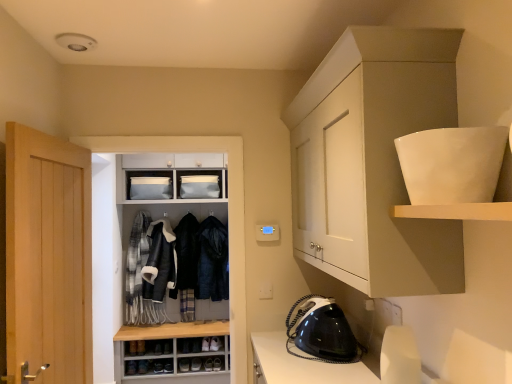
In order to face white matte cabinet at upper right, acting as the second cabinetry starting from the back, should I rotate leftwards or rightwards?

You should look right and rotate roughly 11.942 degrees.

Where is `leather shoes at center`? This screenshot has width=512, height=384. leather shoes at center is located at coordinates (196, 364).

What is the approximate height of leather shoes at center?

It is 6.07 centimeters.

This screenshot has width=512, height=384. I want to click on velvet black coat at center, the second clothing from the right, so click(x=187, y=251).

I want to click on white matte shelf at upper right, positioned as the second shelf in top-to-bottom order, so click(x=456, y=211).

What do you see at coordinates (213, 261) in the screenshot? I see `dark blue fur-lined coat at center, which ranks as the fourth clothing in left-to-right order` at bounding box center [213, 261].

Where is `dark blue fur-lined coat at center, which is the 1th clothing in right-to-left order`? The width and height of the screenshot is (512, 384). dark blue fur-lined coat at center, which is the 1th clothing in right-to-left order is located at coordinates (213, 261).

I want to click on light wood door at left, so [x=48, y=256].

Where is `footwear below the black glossy iron at lower right (from the image's perspective)`? footwear below the black glossy iron at lower right (from the image's perspective) is located at coordinates (196, 364).

Between black glossy iron at lower right and leather shoes at center, which one has less height?

leather shoes at center.

Considering the relative positions of black glossy iron at lower right and leather shoes at center in the image provided, is black glossy iron at lower right behind leather shoes at center?

No, black glossy iron at lower right is closer to the camera.

Is point (330, 312) positioned behind point (197, 368)?

No, (330, 312) is in front of (197, 368).

Is black glossy iron at lower right not within velvet black coat at center, acting as the 3th clothing starting from the left?

black glossy iron at lower right lies outside velvet black coat at center, acting as the 3th clothing starting from the left,'s area.

Is black glossy iron at lower right facing towards velvet black coat at center, acting as the 3th clothing starting from the left?

No, black glossy iron at lower right does not turn towards velvet black coat at center, acting as the 3th clothing starting from the left.

From a real-world perspective, is black glossy iron at lower right on top of velvet black coat at center, the second clothing from the right?

No, from a real-world perspective, black glossy iron at lower right is not on top of velvet black coat at center, the second clothing from the right.

Relative to velvet black coat at center, the second clothing from the right, is black glossy iron at lower right in front or behind?

black glossy iron at lower right is in front of velvet black coat at center, the second clothing from the right.

Is leather shoes at center further to camera compared to light wood door at left?

Yes, leather shoes at center is further from the camera.

Is leather shoes at center wider than light wood door at left?

Yes, leather shoes at center is wider than light wood door at left.

Is light wood door at left at the back of leather shoes at center?

leather shoes at center is not turned away from light wood door at left.

Looking at this image, how different are the orientations of leather shoes at center and light wood door at left in degrees?

80.8 degrees separate the facing orientations of leather shoes at center and light wood door at left.

Is white matte cabinet at upper right, acting as the first cabinetry starting from the right, beside plaid wool scarf at center left, which is the fourth clothing in right-to-left order?

No, white matte cabinet at upper right, acting as the first cabinetry starting from the right, is not with plaid wool scarf at center left, which is the fourth clothing in right-to-left order.

Consider the image. How much distance is there between white matte cabinet at upper right, the 2th cabinetry when ordered from left to right, and plaid wool scarf at center left, which is the fourth clothing in right-to-left order?

The distance of white matte cabinet at upper right, the 2th cabinetry when ordered from left to right, from plaid wool scarf at center left, which is the fourth clothing in right-to-left order, is 2.95 meters.

What's the angular difference between white matte cabinet at upper right, acting as the first cabinetry starting from the right, and plaid wool scarf at center left, which is the fourth clothing in right-to-left order,'s facing directions?

90.6 degrees separate the facing orientations of white matte cabinet at upper right, acting as the first cabinetry starting from the right, and plaid wool scarf at center left, which is the fourth clothing in right-to-left order.

Which is more to the left, white matte cabinet at upper right, acting as the first cabinetry starting from the right, or plaid wool scarf at center left, which ranks as the first clothing in left-to-right order?

plaid wool scarf at center left, which ranks as the first clothing in left-to-right order.

Would you say white glossy bowl at upper right, marked as the 2th shelf in a bottom-to-top arrangement, is to the left or to the right of dark blue fur-lined coat at center, which is the 1th clothing in right-to-left order, in the picture?

Based on their positions, white glossy bowl at upper right, marked as the 2th shelf in a bottom-to-top arrangement, is located to the right of dark blue fur-lined coat at center, which is the 1th clothing in right-to-left order.

Would you say white glossy bowl at upper right, marked as the 2th shelf in a bottom-to-top arrangement, is inside or outside dark blue fur-lined coat at center, which is the 1th clothing in right-to-left order?

white glossy bowl at upper right, marked as the 2th shelf in a bottom-to-top arrangement, is outside dark blue fur-lined coat at center, which is the 1th clothing in right-to-left order.

Based on their sizes in the image, would you say white glossy bowl at upper right, which is counted as the 1th shelf, starting from the top, is bigger or smaller than dark blue fur-lined coat at center, which is the 1th clothing in right-to-left order?

In the image, white glossy bowl at upper right, which is counted as the 1th shelf, starting from the top, appears to be smaller than dark blue fur-lined coat at center, which is the 1th clothing in right-to-left order.

In the image, is white glossy bowl at upper right, which is counted as the 1th shelf, starting from the top, positioned in front of or behind dark blue fur-lined coat at center, which ranks as the fourth clothing in left-to-right order?

Visually, white glossy bowl at upper right, which is counted as the 1th shelf, starting from the top, is located in front of dark blue fur-lined coat at center, which ranks as the fourth clothing in left-to-right order.

Is matte white cabinet at center, placed as the first cabinetry when sorted from back to front, positioned beyond the bounds of plaid wool scarf at center left, which is the fourth clothing in right-to-left order?

Indeed, matte white cabinet at center, placed as the first cabinetry when sorted from back to front, is completely outside plaid wool scarf at center left, which is the fourth clothing in right-to-left order.

Consider the image. Is matte white cabinet at center, placed as the first cabinetry when sorted from back to front, positioned far away from plaid wool scarf at center left, which ranks as the first clothing in left-to-right order?

No, matte white cabinet at center, placed as the first cabinetry when sorted from back to front, is not far away from plaid wool scarf at center left, which ranks as the first clothing in left-to-right order.

Is matte white cabinet at center, marked as the 2th cabinetry in a front-to-back arrangement, aimed at plaid wool scarf at center left, which ranks as the first clothing in left-to-right order?

Yes, matte white cabinet at center, marked as the 2th cabinetry in a front-to-back arrangement, is turned towards plaid wool scarf at center left, which ranks as the first clothing in left-to-right order.

Considering the positions of points (217, 287) and (131, 264), is point (217, 287) farther from camera compared to point (131, 264)?

No.

This screenshot has width=512, height=384. There is a matte white cabinet at center, which is the second cabinetry in right-to-left order. In order to click on the 2nd shelf above it (from the image's perspective) in this screenshot , I will do `click(455, 174)`.

From the image's perspective, which is below, matte white cabinet at center, placed as the first cabinetry when sorted from left to right, or white glossy bowl at upper right, which is counted as the 1th shelf, starting from the top?

matte white cabinet at center, placed as the first cabinetry when sorted from left to right, from the image's perspective.

Would you consider matte white cabinet at center, marked as the 2th cabinetry in a front-to-back arrangement, to be distant from white glossy bowl at upper right, marked as the 2th shelf in a bottom-to-top arrangement?

Indeed, matte white cabinet at center, marked as the 2th cabinetry in a front-to-back arrangement, is not near white glossy bowl at upper right, marked as the 2th shelf in a bottom-to-top arrangement.

What are the coordinates of `footwear on the left of black glossy iron at lower right` in the screenshot? It's located at (196, 364).

Identify the location of appliance lying in front of the velvet black coat at center, acting as the 3th clothing starting from the left. The width and height of the screenshot is (512, 384). (322, 332).

Looking at the image, which one is located further to light wood door at left, plaid wool scarf at center left, which is the fourth clothing in right-to-left order, or dark blue fur-lined coat at center, which is the 1th clothing in right-to-left order?

dark blue fur-lined coat at center, which is the 1th clothing in right-to-left order, is positioned further to the anchor light wood door at left.

Consider the image. Estimate the real-world distances between objects in this image. Which object is closer to leather shoes at center, white matte shelf at upper right, the 1th shelf ordered from the bottom, or black glossy iron at lower right?

black glossy iron at lower right is positioned closer to the anchor leather shoes at center.

From the image, which object appears to be nearer to plaid wool scarf at center left, which ranks as the first clothing in left-to-right order, white glossy bowl at upper right, which is counted as the 1th shelf, starting from the top, or leather shoes at center?

Based on the image, leather shoes at center appears to be nearer to plaid wool scarf at center left, which ranks as the first clothing in left-to-right order.

Considering their positions, is matte white cabinet at center, marked as the 2th cabinetry in a front-to-back arrangement, positioned closer to dark blue fur-lined coat at center, which is the 1th clothing in right-to-left order, than leather shoes at center?

matte white cabinet at center, marked as the 2th cabinetry in a front-to-back arrangement, is closer to dark blue fur-lined coat at center, which is the 1th clothing in right-to-left order.

Looking at the image, which one is located further to white matte cabinet at upper right, the 2th cabinetry when ordered from left to right, leather jacket at center, arranged as the third clothing when viewed from the right, or plaid wool scarf at center left, which is the fourth clothing in right-to-left order?

Based on the image, plaid wool scarf at center left, which is the fourth clothing in right-to-left order, appears to be further to white matte cabinet at upper right, the 2th cabinetry when ordered from left to right.

Which object lies further to the anchor point white matte shelf at upper right, positioned as the second shelf in top-to-bottom order, plaid wool scarf at center left, which is the fourth clothing in right-to-left order, or dark blue fur-lined coat at center, which ranks as the fourth clothing in left-to-right order?

The object further to white matte shelf at upper right, positioned as the second shelf in top-to-bottom order, is plaid wool scarf at center left, which is the fourth clothing in right-to-left order.

When comparing their distances from leather shoes at center, does white matte shelf at upper right, positioned as the second shelf in top-to-bottom order, or velvet black coat at center, the second clothing from the right, seem further?

Based on the image, white matte shelf at upper right, positioned as the second shelf in top-to-bottom order, appears to be further to leather shoes at center.

From the image, which object appears to be nearer to dark blue fur-lined coat at center, which ranks as the fourth clothing in left-to-right order, velvet black coat at center, acting as the 3th clothing starting from the left, or plaid wool scarf at center left, which is the fourth clothing in right-to-left order?

The object closer to dark blue fur-lined coat at center, which ranks as the fourth clothing in left-to-right order, is velvet black coat at center, acting as the 3th clothing starting from the left.

I want to click on clothing between black glossy iron at lower right and plaid wool scarf at center left, which ranks as the first clothing in left-to-right order, in the front-back direction, so click(159, 262).

This screenshot has height=384, width=512. Find the location of `appliance between white matte cabinet at upper right, which ranks as the first cabinetry in front-to-back order, and plaid wool scarf at center left, which is the fourth clothing in right-to-left order, along the z-axis`. appliance between white matte cabinet at upper right, which ranks as the first cabinetry in front-to-back order, and plaid wool scarf at center left, which is the fourth clothing in right-to-left order, along the z-axis is located at coordinates (322, 332).

You are a GUI agent. You are given a task and a screenshot of the screen. Output one action in this format:
    pyautogui.click(x=<x>, y=<y>)
    Task: Click on the footwear between black glossy iron at lower right and plaid wool scarf at center left, which ranks as the first clothing in left-to-right order, from front to back
    The height and width of the screenshot is (384, 512).
    Given the screenshot: What is the action you would take?
    pyautogui.click(x=196, y=364)

Identify the location of footwear positioned between black glossy iron at lower right and leather jacket at center, arranged as the third clothing when viewed from the right, from near to far. The image size is (512, 384). (196, 364).